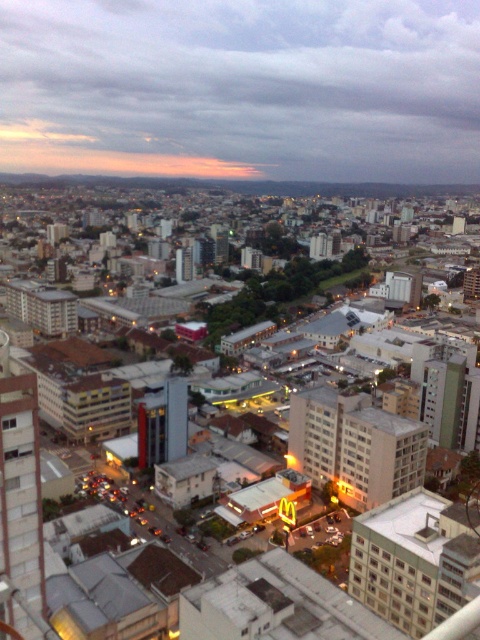
Does cloudy sky at upper center have a greater width compared to matte concrete buildings at center?

Yes, cloudy sky at upper center is wider than matte concrete buildings at center.

Between point (69, 58) and point (67, 314), which one is positioned behind?

The point (69, 58) is behind.

At what (x,y) coordinates should I click in order to perform the action: click on cloudy sky at upper center. Please return your answer as a coordinate pair (x, y). Looking at the image, I should click on (242, 90).